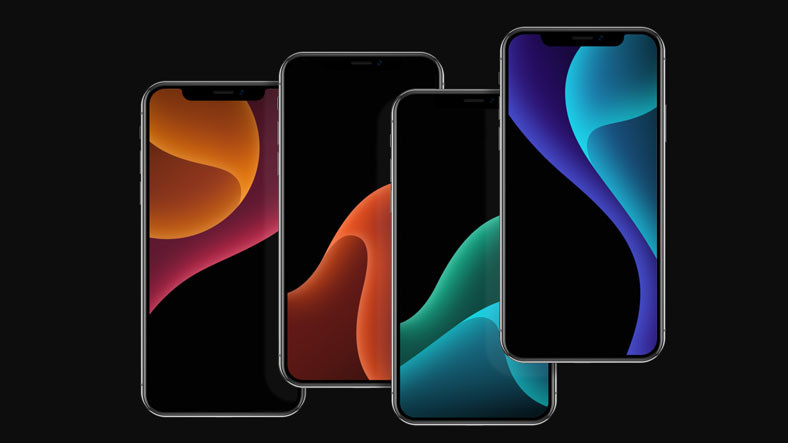
Find the location of a particular element. This screenshot has height=443, width=788. 1 phone with orange on screen is located at coordinates [x=358, y=284].